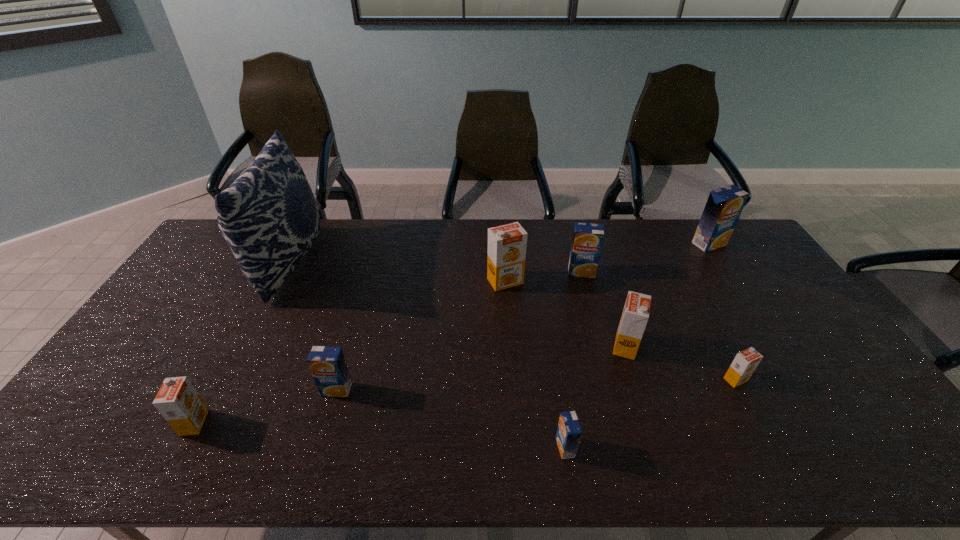
Locate an element on the screen. vacant space in between the fifth nearest orange_juice and the tallest object is located at coordinates (457, 305).

Find the location of a particular element. The image size is (960, 540). empty space between the fifth object from right to left and the second biggest orange orange juice is located at coordinates (595, 397).

I want to click on free spot between the tallest object and the second biggest blue orange_juice, so click(x=436, y=267).

At what (x,y) coordinates should I click in order to perform the action: click on free spot between the smallest blue orange_juice and the smallest orange orange juice. Please return your answer as a coordinate pair (x, y). Looking at the image, I should click on point(651,414).

At what (x,y) coordinates should I click in order to perform the action: click on the closest object to the fifth nearest orange_juice. Please return your answer as a coordinate pair (x, y). Image resolution: width=960 pixels, height=540 pixels. Looking at the image, I should click on (744, 364).

Identify which object is located as the fourth nearest to the nearest orange orange juice. Please provide its 2D coordinates. Your answer should be formatted as a tuple, i.e. [(x, y)], where the tuple contains the x and y coordinates of a point satisfying the conditions above.

[(569, 432)]

What are the coordinates of `the closest orange_juice relative to the sixth orange_juice from right to left` in the screenshot? It's located at 587,241.

Find the location of a particular element. The height and width of the screenshot is (540, 960). orange_juice that stands as the fourth closest to the farthest orange orange juice is located at coordinates (569, 432).

This screenshot has width=960, height=540. Identify the location of blue orange_juice that is the second closest one to the fifth object from right to left. (587, 241).

Point out which blue orange_juice is positioned as the second nearest to the sixth object from right to left. Please provide its 2D coordinates. Your answer should be formatted as a tuple, i.e. [(x, y)], where the tuple contains the x and y coordinates of a point satisfying the conditions above.

[(327, 364)]